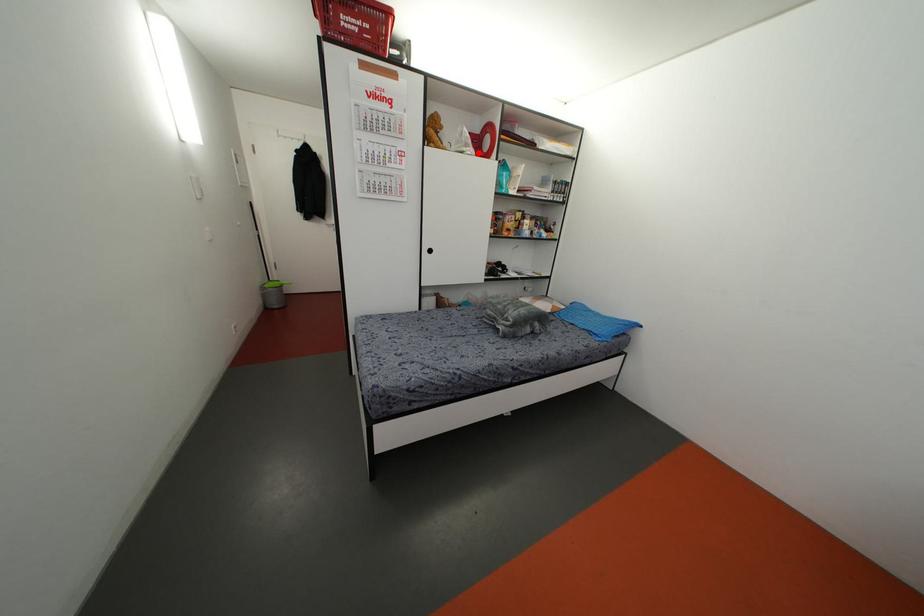
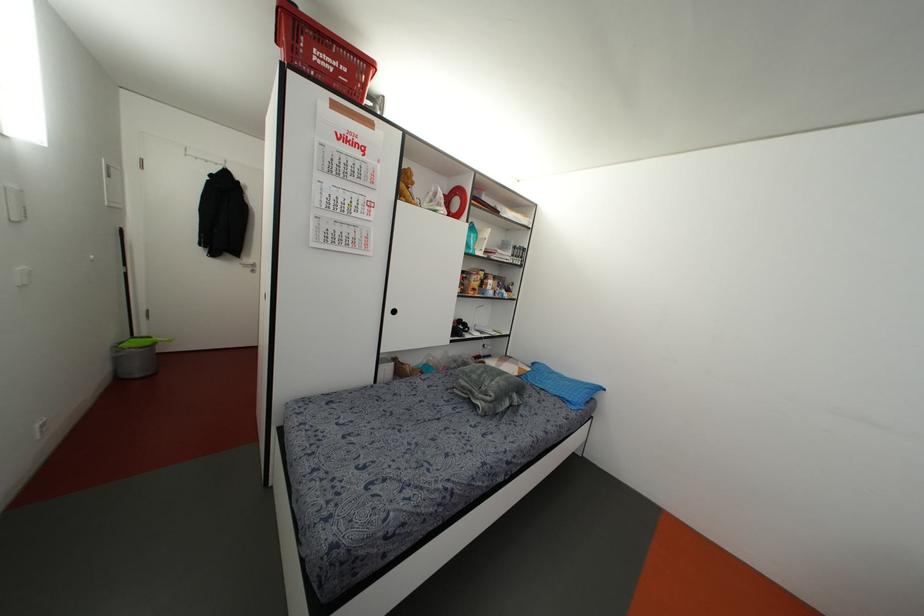
In the second image, find the point that corresponds to the highlighted location in the first image.

(448, 213)